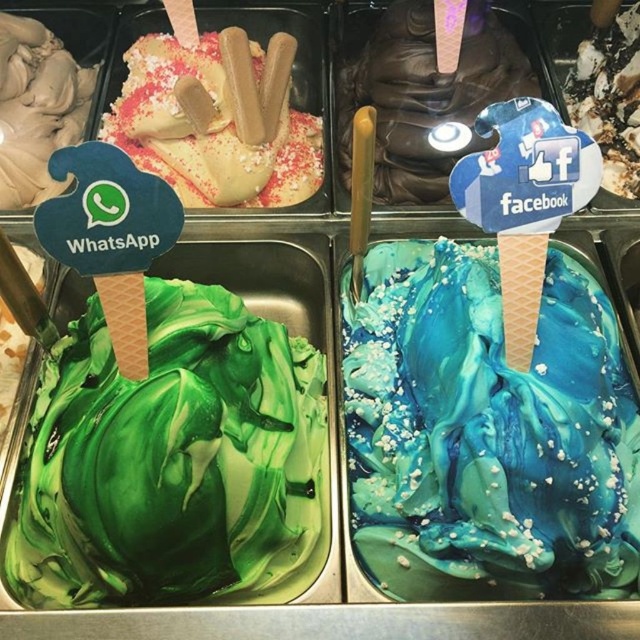
You are a customer at an ice cream shop and want to choose between the green marbled ice cream at left and the smooth chocolate ice cream cone at upper center. Which one is narrower?

The green marbled ice cream at left has a lesser width compared to the smooth chocolate ice cream cone at upper center, so the green marbled ice cream at left is narrower.

Consider the image. You are a customer at an ice cream shop and want to choose between the green marbled ice cream at left and the smooth chocolate ice cream cone at upper center. Which one has a greater height?

The green marbled ice cream at left is much taller than the smooth chocolate ice cream cone at upper center, so the green marbled ice cream at left has a greater height.